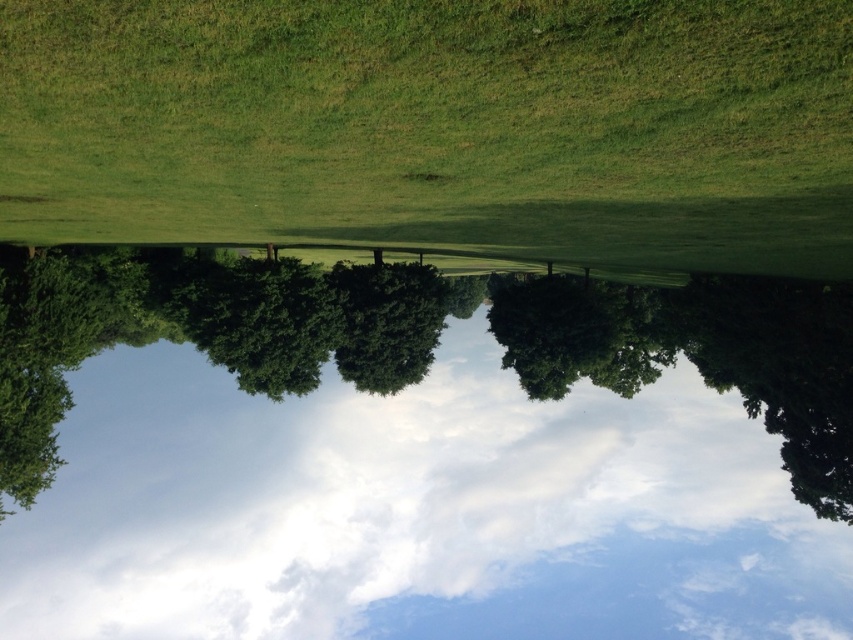
Is white fluffy cloud at upper center to the right of green grassy field at center from the viewer's perspective?

Yes, white fluffy cloud at upper center is to the right of green grassy field at center.

Does white fluffy cloud at upper center have a greater width compared to green grassy field at center?

Yes.

I want to click on white fluffy cloud at upper center, so click(418, 452).

Find the location of `white fluffy cloud at upper center`. white fluffy cloud at upper center is located at coordinates pos(418,452).